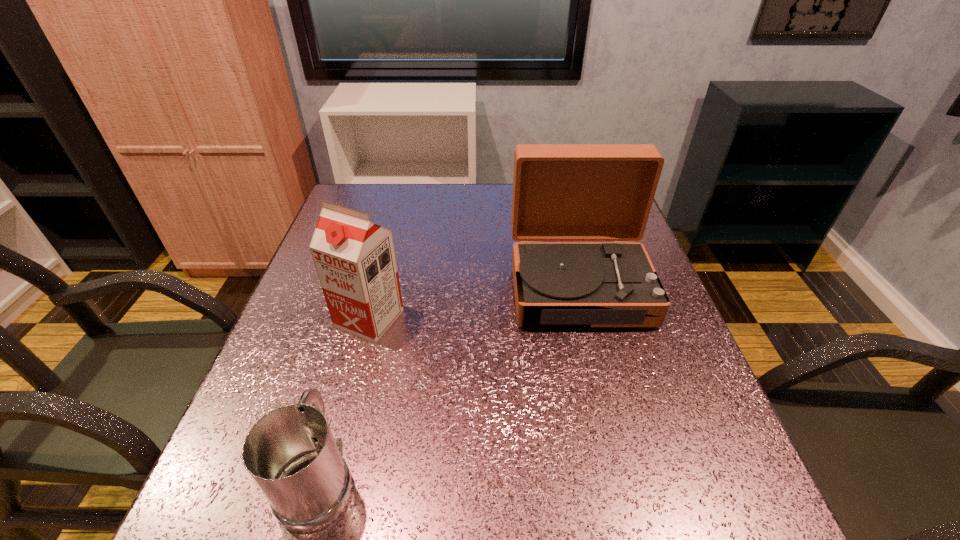
Where is `vacant area between the phonograph record and the shortest object`? vacant area between the phonograph record and the shortest object is located at coordinates pyautogui.click(x=448, y=382).

Locate an element on the screen. Image resolution: width=960 pixels, height=540 pixels. free space between the soya milk and the shortest object is located at coordinates (345, 398).

Locate an element on the screen. free point between the phonograph record and the soya milk is located at coordinates (474, 303).

This screenshot has height=540, width=960. Find the location of `vacant area that lies between the soya milk and the nearest object`. vacant area that lies between the soya milk and the nearest object is located at coordinates (345, 398).

I want to click on free point between the soya milk and the phonograph record, so tap(474, 303).

Locate an element on the screen. The width and height of the screenshot is (960, 540). free spot between the soya milk and the nearest object is located at coordinates (345, 398).

Image resolution: width=960 pixels, height=540 pixels. What are the coordinates of `vacant space that is in between the soya milk and the phonograph record` in the screenshot? It's located at (474, 303).

This screenshot has height=540, width=960. Identify the location of empty space that is in between the phonograph record and the shortest object. (448, 382).

Select which object is the closest to the shortest object. Please provide its 2D coordinates. Your answer should be formatted as a tuple, i.e. [(x, y)], where the tuple contains the x and y coordinates of a point satisfying the conditions above.

[(355, 260)]

Where is `object that can be found as the closest to the soya milk`? object that can be found as the closest to the soya milk is located at coordinates (290, 453).